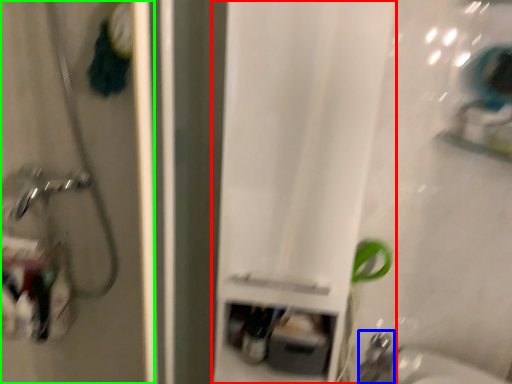
Question: Estimate the real-world distances between objects in this image. Which object is farther from curtain (highlighted by a red box), faucet (highlighted by a blue box) or screen door (highlighted by a green box)?

Choices:
 (A) faucet
 (B) screen door

Answer: (A)